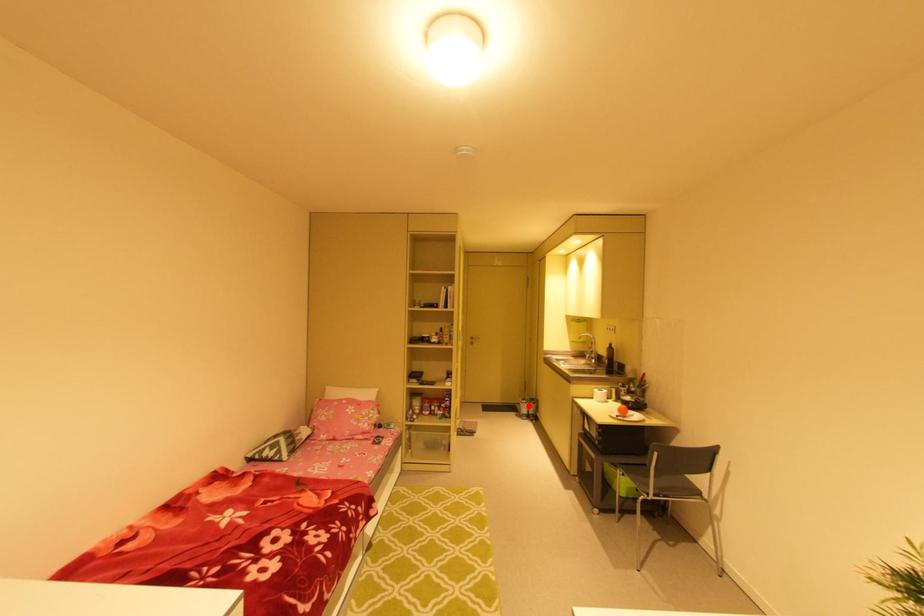
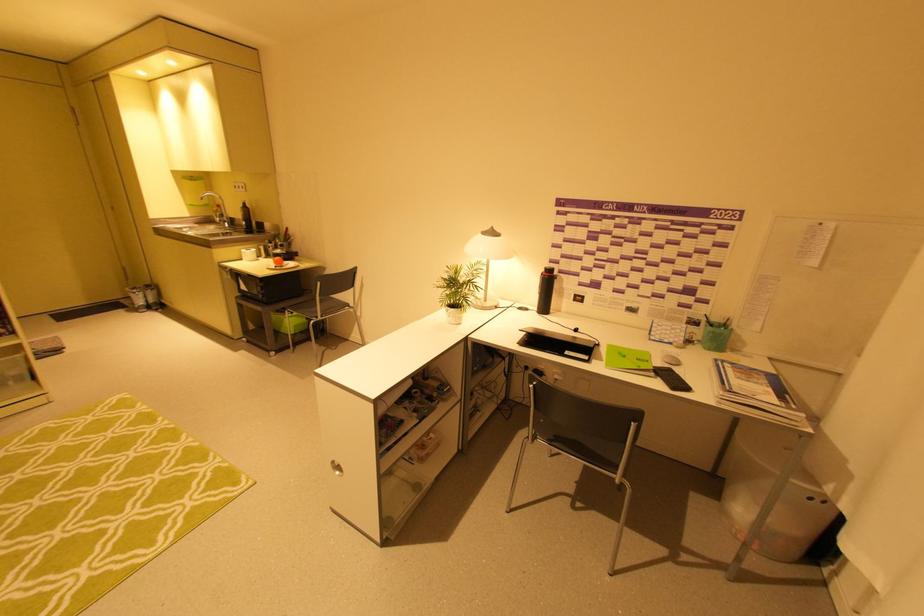
Find the pixel in the second image that matches the highlighted location in the first image.

(142, 296)